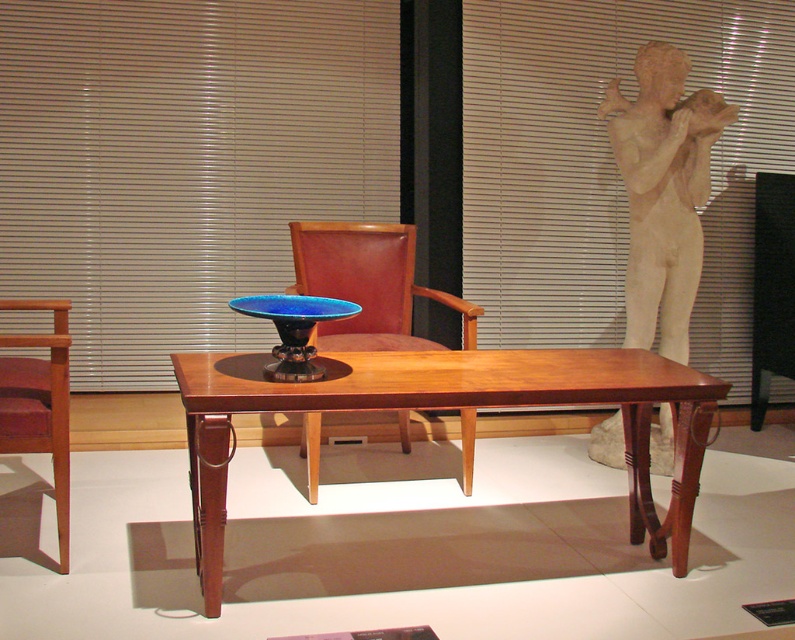
Question: Which point is closer to the camera?

Choices:
 (A) beige blinds at center
 (B) mahogany wood table at center

Answer: (B)

Question: Estimate the real-world distances between objects in this image. Which object is farther from the beige blinds at center?

Choices:
 (A) brown leather chair at center
 (B) blue glass bowl at center
 (C) mahogany wood table at center
 (D) matte white blind at upper right

Answer: (C)

Question: In this image, where is matte white blind at upper right located relative to brown leather chair at center?

Choices:
 (A) below
 (B) above

Answer: (B)

Question: Can you confirm if beige blinds at center is smaller than matte white blind at upper right?

Choices:
 (A) yes
 (B) no

Answer: (A)

Question: Considering the real-world distances, which object is closest to the matte white blind at upper right?

Choices:
 (A) blue glass bowl at center
 (B) mahogany wood table at center

Answer: (B)

Question: Can you confirm if brown leather chair at center is positioned above mahogany wood chair at left?

Choices:
 (A) yes
 (B) no

Answer: (A)